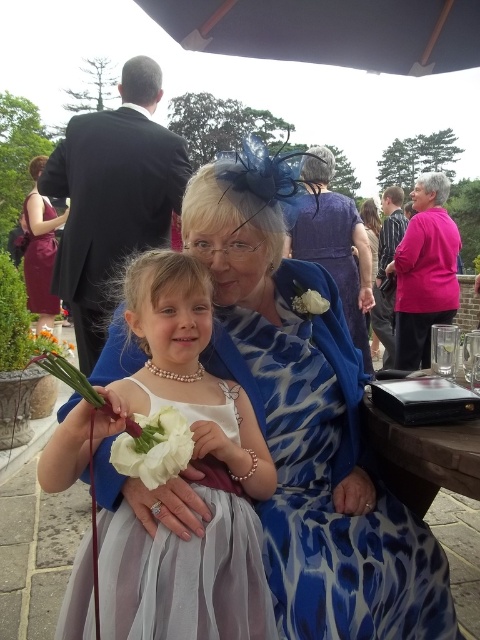
Based on the photo, you are standing at the point labeled point (29, 336) and want to walk towards the point labeled point (110, 577). According to the scene, will you be moving towards the background or the foreground?

Point (110, 577) is in front of point (29, 336). So moving from point (29, 336) towards point (110, 577) means you are moving towards the foreground.

You are a photographer at the event and need to capture a closeup of both the white satin dress at lower left and the white silk flower at lower left. Which object should you focus on first if you want to start with the one closer to the camera?

The white satin dress at lower left is positioned on the right side of the white silk flower at lower left, so the white satin dress at lower left is closer to the camera. You should focus on the white satin dress at lower left first.